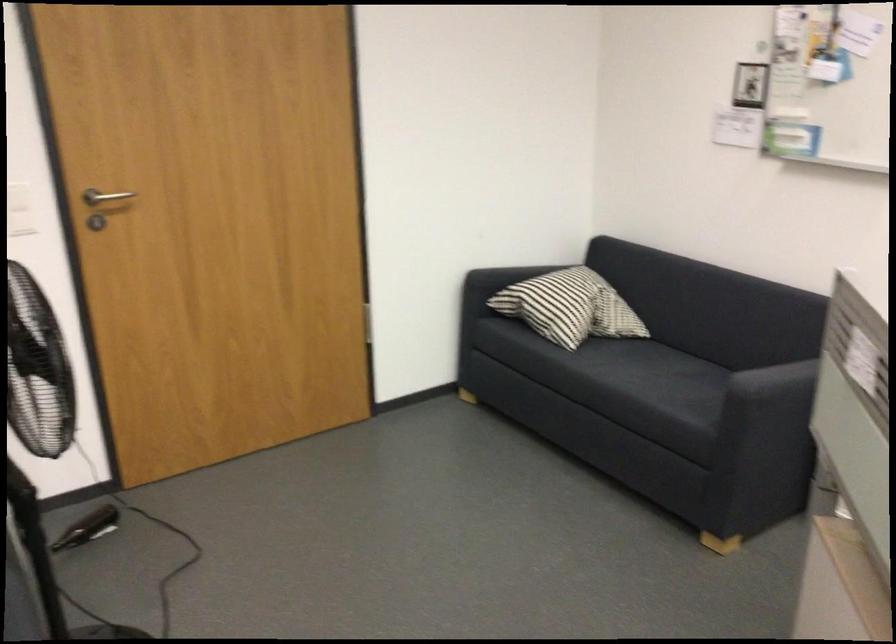
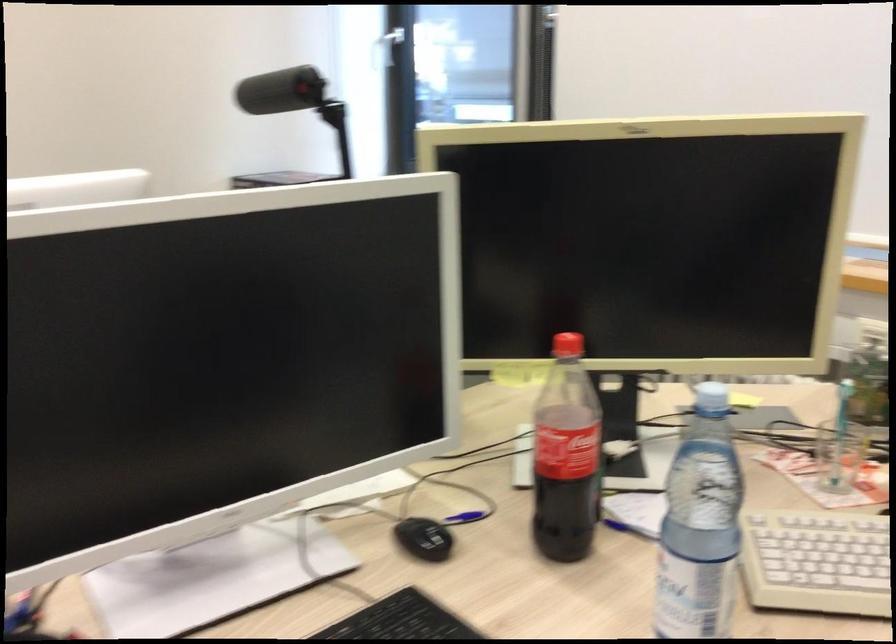
First-person continuous shooting, in which direction is the camera rotating?

The rotation direction of the camera is right-down.